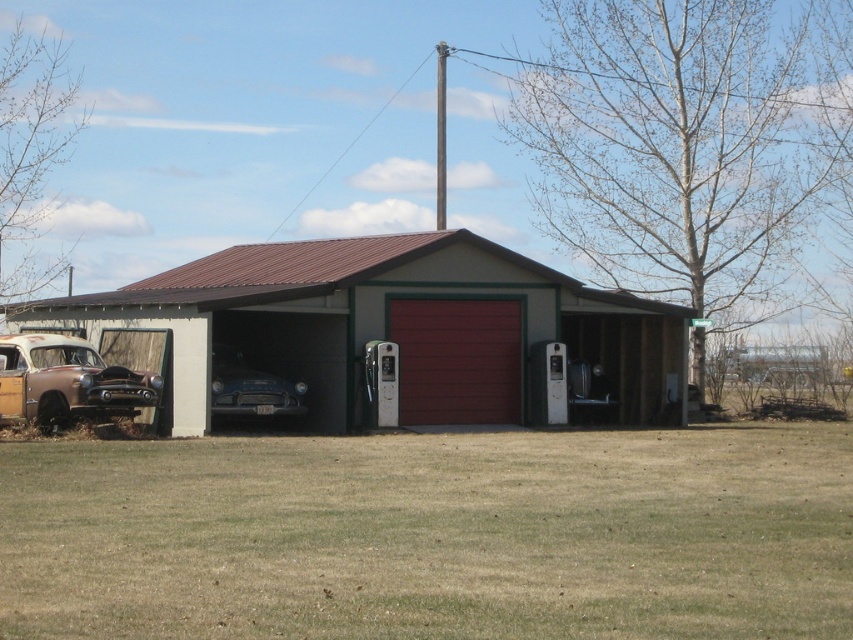
You are a delivery person trying to enter the garage. The metallic red garage door at center and the matte red garage door at center are both closed. Which door should you open first to access the garage?

You should open the metallic red garage door at center first since it is in front of the matte red garage door at center, meaning the metallic one is the outer door leading into the garage.

You are a delivery person arriving at this location and need to park your vehicle. There is a matte red garage door at center and a shiny blue car at center. Can you drive your truck through the open space between them?

The matte red garage door at center is positioned over shiny blue car at center, meaning there is no open space between them for the truck to pass through.

You are a delivery person trying to park your truck in front of the garage. The truck requires a space that is at least as wide as the metallic red garage door at center. Can the truck park in the space next to the matte red garage door at center?

The metallic red garage door at center has a larger size compared to the matte red garage door at center. Since the truck requires a space at least as wide as the metallic red garage door at center, the space next to the matte red garage door at center may not be wide enough. Please check the width of the space before parking.